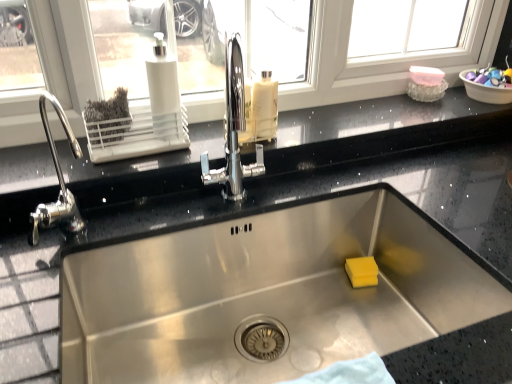
What do you see at coordinates (374, 117) in the screenshot? I see `black granite countertop at upper center` at bounding box center [374, 117].

Measure the distance between translucent plastic bottle at center and camera.

translucent plastic bottle at center and camera are 36.07 inches apart.

Locate an element on the screen. Image resolution: width=512 pixels, height=384 pixels. white plastic soap dispenser at upper left is located at coordinates (164, 92).

The height and width of the screenshot is (384, 512). I want to click on basin that is under the translucent plastic bottle at center (from a real-world perspective), so click(x=485, y=91).

Who is smaller, translucent plastic bottle at center or plastic bowl at upper right?

With smaller size is translucent plastic bottle at center.

Is translucent plastic bottle at center not close to plastic bowl at upper right?

They are positioned close to each other.

Could plastic bowl at upper right be considered to be inside translucent plastic bottle at center?

No.

Find the location of `cleaning product to the left of black granite countertop at upper center`. cleaning product to the left of black granite countertop at upper center is located at coordinates (264, 108).

From a real-world perspective, is black granite countertop at upper center on top of translucent plastic bottle at center?

No, from a real-world perspective, black granite countertop at upper center is not over translucent plastic bottle at center

Is black granite countertop at upper center wider than translucent plastic bottle at center?

Yes.

Can you tell me how much black granite countertop at upper center and translucent plastic bottle at center differ in facing direction?

The facing directions of black granite countertop at upper center and translucent plastic bottle at center are 0.639 degrees apart.

Is black granite countertop at upper center positioned before plastic bowl at upper right?

Yes.

Is black granite countertop at upper center facing towards plastic bowl at upper right?

No, black granite countertop at upper center is not facing towards plastic bowl at upper right.

Is black granite countertop at upper center next to plastic bowl at upper right?

No.

Visually, is black granite countertop at upper center positioned to the left or to the right of plastic bowl at upper right?

From the image, it's evident that black granite countertop at upper center is to the left of plastic bowl at upper right.

The image size is (512, 384). I want to click on cleaning product behind the white plastic soap dispenser at upper left, so click(x=264, y=108).

Is translucent plastic bottle at center located within white plastic soap dispenser at upper left?

No, translucent plastic bottle at center is not inside white plastic soap dispenser at upper left.

Is point (163, 118) behind point (273, 127)?

No.

Is white plastic soap dispenser at upper left directly adjacent to translucent plastic bottle at center?

No, white plastic soap dispenser at upper left is not with translucent plastic bottle at center.

Considering the sizes of objects plastic bowl at upper right and white plastic soap dispenser at upper left in the image provided, who is wider, plastic bowl at upper right or white plastic soap dispenser at upper left?

Wider between the two is plastic bowl at upper right.

From a real-world perspective, is plastic bowl at upper right over white plastic soap dispenser at upper left?

No, from a real-world perspective, plastic bowl at upper right is not over white plastic soap dispenser at upper left

Find the location of a particular element. The width and height of the screenshot is (512, 384). basin located on the right of white plastic soap dispenser at upper left is located at coordinates (485, 91).

Looking at this image, from the image's perspective, which is below, plastic bowl at upper right or white plastic soap dispenser at upper left?

From the image's view, white plastic soap dispenser at upper left is below.

Can you confirm if white plastic soap dispenser at upper left is shorter than black granite countertop at upper center?

No.

Is white plastic soap dispenser at upper left not within black granite countertop at upper center?

That's correct, white plastic soap dispenser at upper left is outside of black granite countertop at upper center.

Who is smaller, white plastic soap dispenser at upper left or black granite countertop at upper center?

white plastic soap dispenser at upper left.

Could you tell me if white plastic soap dispenser at upper left is facing black granite countertop at upper center?

No, white plastic soap dispenser at upper left is not aimed at black granite countertop at upper center.

Looking at this image, is plastic bowl at upper right bigger or smaller than translucent plastic bottle at center?

plastic bowl at upper right is bigger than translucent plastic bottle at center.

Consider the image. Can you tell me how much plastic bowl at upper right and translucent plastic bottle at center differ in facing direction?

plastic bowl at upper right and translucent plastic bottle at center are facing 0.000319 degrees away from each other.

Is plastic bowl at upper right positioned far away from translucent plastic bottle at center?

They are positioned close to each other.

You are a GUI agent. You are given a task and a screenshot of the screen. Output one action in this format:
    pyautogui.click(x=<x>, y=<y>)
    Task: Click on the basin on the right of translucent plastic bottle at center
    This screenshot has height=384, width=512.
    Given the screenshot: What is the action you would take?
    click(x=485, y=91)

Locate an element on the screen. Image resolution: width=512 pixels, height=384 pixels. cleaning product behind the black granite countertop at upper center is located at coordinates (264, 108).

From the image, which object appears to be farther from translucent plastic bottle at center, black granite countertop at upper center or plastic bowl at upper right?

The object further to translucent plastic bottle at center is plastic bowl at upper right.

From the image, which object appears to be farther from translucent plastic bottle at center, plastic bowl at upper right or black granite countertop at upper center?

plastic bowl at upper right is positioned further to the anchor translucent plastic bottle at center.

Estimate the real-world distances between objects in this image. Which object is further from plastic bowl at upper right, translucent plastic bottle at center or black granite countertop at upper center?

translucent plastic bottle at center lies further to plastic bowl at upper right than the other object.

Based on the photo, looking at the image, which one is located further to translucent plastic bottle at center, white plastic soap dispenser at upper left or plastic bowl at upper right?

The object further to translucent plastic bottle at center is plastic bowl at upper right.

Based on their spatial positions, is plastic bowl at upper right or translucent plastic bottle at center closer to white plastic soap dispenser at upper left?

translucent plastic bottle at center is closer to white plastic soap dispenser at upper left.

Which object lies further to the anchor point white plastic soap dispenser at upper left, black granite countertop at upper center or translucent plastic bottle at center?

black granite countertop at upper center is further to white plastic soap dispenser at upper left.

Based on their spatial positions, is white plastic soap dispenser at upper left or translucent plastic bottle at center further from black granite countertop at upper center?

white plastic soap dispenser at upper left.

Estimate the real-world distances between objects in this image. Which object is closer to plastic bowl at upper right, white plastic soap dispenser at upper left or black granite countertop at upper center?

Among the two, black granite countertop at upper center is located nearer to plastic bowl at upper right.

Where is `window sill between white plastic soap dispenser at upper left and plastic bowl at upper right in the horizontal direction`? window sill between white plastic soap dispenser at upper left and plastic bowl at upper right in the horizontal direction is located at coordinates (374, 117).

Identify the location of window sill between translucent plastic bottle at center and plastic bowl at upper right from left to right. (374, 117).

What are the coordinates of `cleaning product situated between white plastic soap dispenser at upper left and plastic bowl at upper right from left to right` in the screenshot? It's located at (264, 108).

At what (x,y) coordinates should I click in order to perform the action: click on cleaning product located between white plastic soap dispenser at upper left and black granite countertop at upper center in the left-right direction. Please return your answer as a coordinate pair (x, y). The width and height of the screenshot is (512, 384). Looking at the image, I should click on (264, 108).